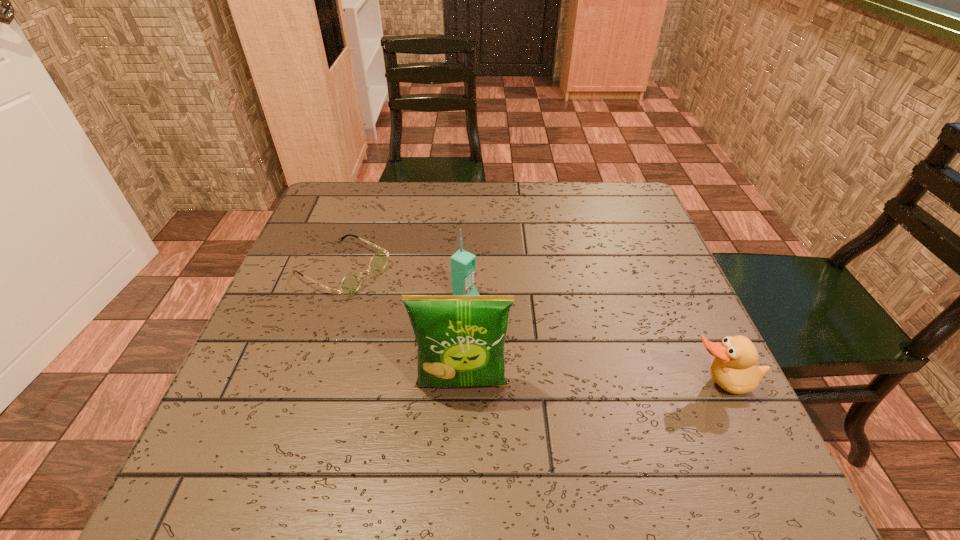
The height and width of the screenshot is (540, 960). What are the coordinates of `crisp (potato chip)` in the screenshot? It's located at (460, 339).

Find the location of a particular element. duck is located at coordinates (733, 369).

The image size is (960, 540). I want to click on the rightmost object, so click(733, 369).

Where is `cellular telephone`? This screenshot has height=540, width=960. cellular telephone is located at coordinates (463, 263).

Locate an element on the screen. the leftmost object is located at coordinates (351, 283).

Where is `the shortest object`? the shortest object is located at coordinates (351, 283).

This screenshot has width=960, height=540. I want to click on vacant space located 0.050m on the front-facing side of the crisp (potato chip), so click(x=461, y=427).

The width and height of the screenshot is (960, 540). What are the coordinates of `vacant space located on the keypad of the cellular telephone` in the screenshot? It's located at (529, 332).

The height and width of the screenshot is (540, 960). What are the coordinates of `vacant region located 0.390m on the keypad of the cellular telephone` in the screenshot? It's located at (653, 398).

Find the location of a particular element. vacant space located on the keypad of the cellular telephone is located at coordinates (545, 341).